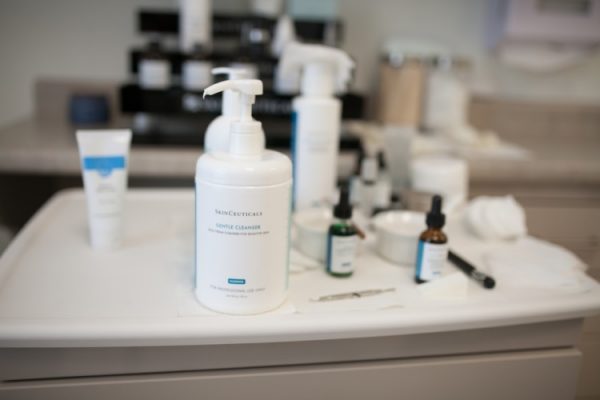
Where is `dispenser`? The image size is (600, 400). dispenser is located at coordinates (251, 87), (234, 74).